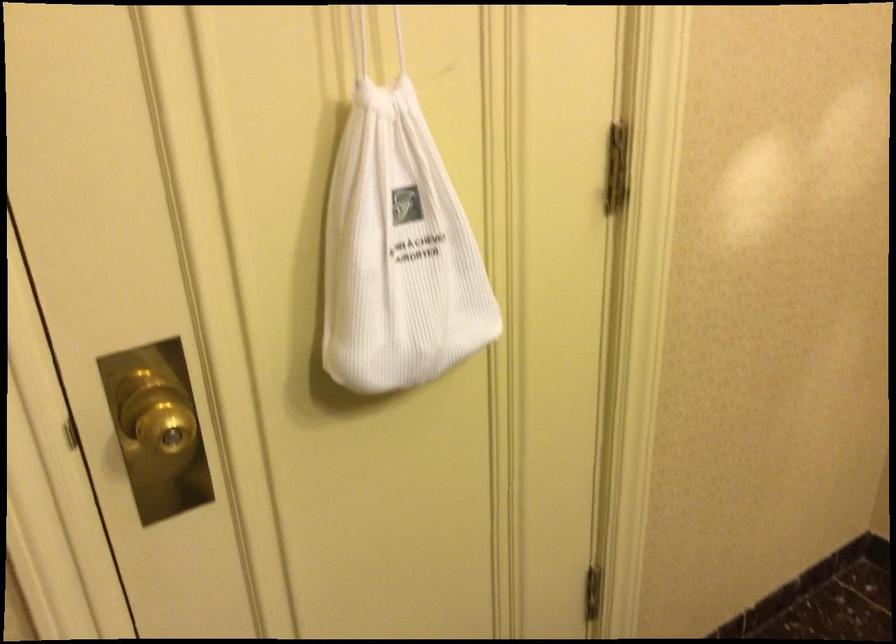
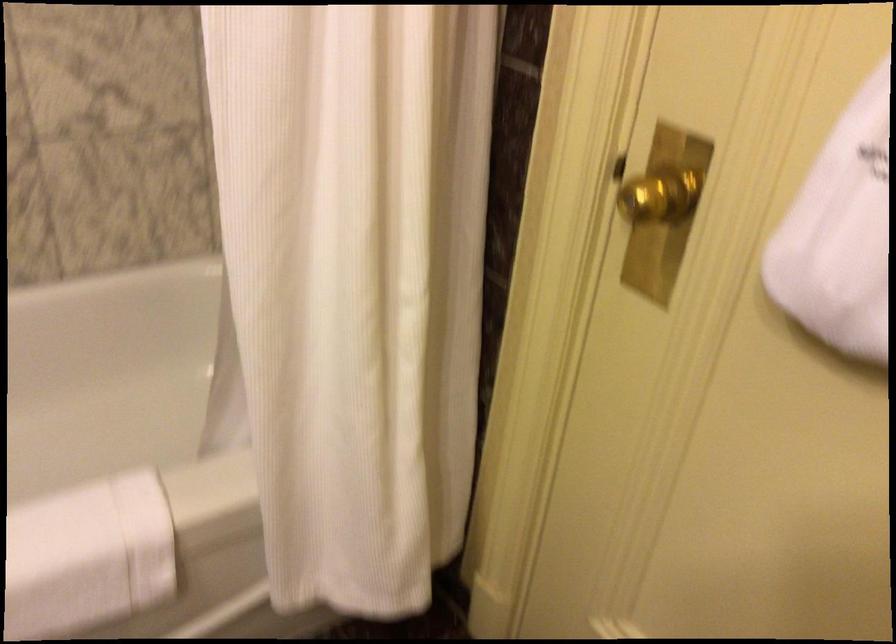
The point at (157, 430) is marked in the first image. Where is the corresponding point in the second image?

(657, 194)